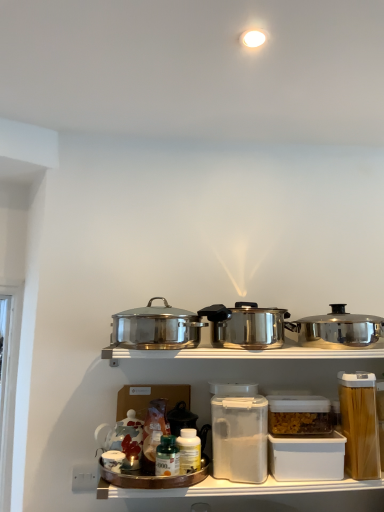
Consider the image. Measure the distance between polished stainless steel pot at right, the third kitchen appliance from the left, and camera.

polished stainless steel pot at right, the third kitchen appliance from the left, and camera are 1.32 meters apart.

This screenshot has height=512, width=384. Identify the location of white plastic bottle at center, the second bottle in the left-to-right sequence. click(x=189, y=450).

The width and height of the screenshot is (384, 512). I want to click on green glass bottle at center, positioned as the second bottle in right-to-left order, so pos(167,457).

Identify the location of polished stainless steel pot at right, the third kitchen appliance from the left. (337, 329).

From the image's perspective, which one is positioned lower, polished stainless steel pot at center, placed as the first kitchen appliance when sorted from left to right, or green glass bottle at center, the first bottle from the left?

green glass bottle at center, the first bottle from the left.

Choose the correct answer: Is polished stainless steel pot at center, placed as the first kitchen appliance when sorted from left to right, inside green glass bottle at center, positioned as the second bottle in right-to-left order, or outside it?

polished stainless steel pot at center, placed as the first kitchen appliance when sorted from left to right, lies outside green glass bottle at center, positioned as the second bottle in right-to-left order.

Is polished stainless steel pot at center, arranged as the third kitchen appliance when viewed from the right, shorter than green glass bottle at center, the first bottle from the left?

In fact, polished stainless steel pot at center, arranged as the third kitchen appliance when viewed from the right, may be taller than green glass bottle at center, the first bottle from the left.

Where is `kitchen appliance that is the 1st object above the green glass bottle at center, positioned as the second bottle in right-to-left order (from a real-world perspective)`? The height and width of the screenshot is (512, 384). kitchen appliance that is the 1st object above the green glass bottle at center, positioned as the second bottle in right-to-left order (from a real-world perspective) is located at coordinates (156, 327).

Is point (166, 467) positioned before point (299, 432)?

Yes, point (166, 467) is closer to viewer.

Relative to clear plastic container at center, which is counted as the 2th appliance, starting from the right, is green glass bottle at center, positioned as the second bottle in right-to-left order, in front or behind?

green glass bottle at center, positioned as the second bottle in right-to-left order, is positioned closer to the viewer than clear plastic container at center, which is counted as the 2th appliance, starting from the right.

From a real-world perspective, is green glass bottle at center, positioned as the second bottle in right-to-left order, under clear plastic container at center, the 2th appliance when ordered from left to right?

Yes, from a real-world perspective, green glass bottle at center, positioned as the second bottle in right-to-left order, is under clear plastic container at center, the 2th appliance when ordered from left to right.

Is green glass bottle at center, positioned as the second bottle in right-to-left order, facing towards clear plastic container at center, the 2th appliance when ordered from left to right?

No, green glass bottle at center, positioned as the second bottle in right-to-left order, is not facing towards clear plastic container at center, the 2th appliance when ordered from left to right.

Can you see clear plastic container at center, which is counted as the 2th appliance, starting from the right, touching polished stainless steel pot at center, placed as the 2th kitchen appliance when sorted from right to left?

clear plastic container at center, which is counted as the 2th appliance, starting from the right, and polished stainless steel pot at center, placed as the 2th kitchen appliance when sorted from right to left, are clearly separated.

From a real-world perspective, who is located higher, clear plastic container at center, which is counted as the 2th appliance, starting from the right, or polished stainless steel pot at center, the 2th kitchen appliance when ordered from left to right?

polished stainless steel pot at center, the 2th kitchen appliance when ordered from left to right, is physically above.

Looking at this image, measure the distance between clear plastic container at center, which is counted as the 2th appliance, starting from the right, and polished stainless steel pot at center, placed as the 2th kitchen appliance when sorted from right to left.

The distance of clear plastic container at center, which is counted as the 2th appliance, starting from the right, from polished stainless steel pot at center, placed as the 2th kitchen appliance when sorted from right to left, is 9.97 inches.

Which object is wider, clear plastic container at center, the 2th appliance when ordered from left to right, or polished stainless steel pot at center, placed as the 2th kitchen appliance when sorted from right to left?

polished stainless steel pot at center, placed as the 2th kitchen appliance when sorted from right to left.

From a real-world perspective, which object rests below the other?

translucent plastic container at center, which ranks as the 3th appliance in right-to-left order, is physically lower.

Consider the image. Between translucent plastic container at center, placed as the first appliance when sorted from left to right, and clear plastic container at lower right, placed as the 1th appliance when sorted from right to left, which one has more height?

clear plastic container at lower right, placed as the 1th appliance when sorted from right to left, is taller.

Considering the sizes of objects translucent plastic container at center, placed as the first appliance when sorted from left to right, and clear plastic container at lower right, the 3th appliance viewed from the left, in the image provided, who is wider, translucent plastic container at center, placed as the first appliance when sorted from left to right, or clear plastic container at lower right, the 3th appliance viewed from the left,?

With larger width is translucent plastic container at center, placed as the first appliance when sorted from left to right.

Which is closer to the camera, (248, 472) or (339, 399)?

The point (248, 472) is closer to the camera.

From the image's perspective, which one is positioned higher, polished stainless steel pot at right, arranged as the 1th kitchen appliance when viewed from the right, or polished stainless steel pot at center, placed as the first kitchen appliance when sorted from left to right?

polished stainless steel pot at center, placed as the first kitchen appliance when sorted from left to right, appears higher in the image.

In the image, is polished stainless steel pot at right, arranged as the 1th kitchen appliance when viewed from the right, positioned in front of or behind polished stainless steel pot at center, placed as the first kitchen appliance when sorted from left to right?

In the image, polished stainless steel pot at right, arranged as the 1th kitchen appliance when viewed from the right, appears behind polished stainless steel pot at center, placed as the first kitchen appliance when sorted from left to right.

Is polished stainless steel pot at right, arranged as the 1th kitchen appliance when viewed from the right, bigger or smaller than polished stainless steel pot at center, arranged as the third kitchen appliance when viewed from the right?

Clearly, polished stainless steel pot at right, arranged as the 1th kitchen appliance when viewed from the right, is smaller in size than polished stainless steel pot at center, arranged as the third kitchen appliance when viewed from the right.

Considering the relative positions of polished stainless steel pot at right, arranged as the 1th kitchen appliance when viewed from the right, and polished stainless steel pot at center, arranged as the third kitchen appliance when viewed from the right, in the image provided, is polished stainless steel pot at right, arranged as the 1th kitchen appliance when viewed from the right, to the left of polished stainless steel pot at center, arranged as the third kitchen appliance when viewed from the right, from the viewer's perspective?

Incorrect, polished stainless steel pot at right, arranged as the 1th kitchen appliance when viewed from the right, is not on the left side of polished stainless steel pot at center, arranged as the third kitchen appliance when viewed from the right.

Considering the sizes of polished stainless steel pot at right, the third kitchen appliance from the left, and clear plastic container at lower right, the 3th appliance viewed from the left, in the image, is polished stainless steel pot at right, the third kitchen appliance from the left, taller or shorter than clear plastic container at lower right, the 3th appliance viewed from the left,?

Considering their sizes, polished stainless steel pot at right, the third kitchen appliance from the left, has less height than clear plastic container at lower right, the 3th appliance viewed from the left.

Based on their sizes in the image, would you say polished stainless steel pot at right, the third kitchen appliance from the left, is bigger or smaller than clear plastic container at lower right, placed as the 1th appliance when sorted from right to left?

Clearly, polished stainless steel pot at right, the third kitchen appliance from the left, is larger in size than clear plastic container at lower right, placed as the 1th appliance when sorted from right to left.

Where is `appliance that is the 1st object to the left of the polished stainless steel pot at right, the third kitchen appliance from the left, starting at the anchor`? appliance that is the 1st object to the left of the polished stainless steel pot at right, the third kitchen appliance from the left, starting at the anchor is located at coordinates (360, 424).

Is polished stainless steel pot at right, the third kitchen appliance from the left, behind clear plastic container at lower right, the 3th appliance viewed from the left?

Yes, polished stainless steel pot at right, the third kitchen appliance from the left, is further from the viewer.

From a real-world perspective, does green glass bottle at center, the first bottle from the left, sit lower than clear plastic container at lower right, the 3th appliance viewed from the left?

Indeed, from a real-world perspective, green glass bottle at center, the first bottle from the left, is positioned beneath clear plastic container at lower right, the 3th appliance viewed from the left.

In terms of width, does green glass bottle at center, the first bottle from the left, look wider or thinner when compared to clear plastic container at lower right, placed as the 1th appliance when sorted from right to left?

Clearly, green glass bottle at center, the first bottle from the left, has less width compared to clear plastic container at lower right, placed as the 1th appliance when sorted from right to left.

Looking at this image, is green glass bottle at center, positioned as the second bottle in right-to-left order, positioned far away from clear plastic container at lower right, the 3th appliance viewed from the left?

That's not correct — green glass bottle at center, positioned as the second bottle in right-to-left order, is a little close to clear plastic container at lower right, the 3th appliance viewed from the left.

From the image's perspective, between green glass bottle at center, positioned as the second bottle in right-to-left order, and clear plastic container at lower right, the 3th appliance viewed from the left, who is located below?

From the image's view, green glass bottle at center, positioned as the second bottle in right-to-left order, is below.

The image size is (384, 512). I want to click on kitchen appliance located on the left of green glass bottle at center, the first bottle from the left, so click(x=156, y=327).

From a real-world perspective, count 2nd bottles downward from the clear plastic container at center, the 2th appliance when ordered from left to right, and point to it. Please provide its 2D coordinates.

[(167, 457)]

From the image, which object appears to be nearer to clear plastic container at center, the 2th appliance when ordered from left to right, polished stainless steel pot at center, arranged as the third kitchen appliance when viewed from the right, or polished stainless steel pot at center, placed as the 2th kitchen appliance when sorted from right to left?

polished stainless steel pot at center, placed as the 2th kitchen appliance when sorted from right to left.

Based on their spatial positions, is polished stainless steel pot at right, arranged as the 1th kitchen appliance when viewed from the right, or white plastic container at lower center closer to polished stainless steel pot at center, placed as the 2th kitchen appliance when sorted from right to left?

Among the two, polished stainless steel pot at right, arranged as the 1th kitchen appliance when viewed from the right, is located nearer to polished stainless steel pot at center, placed as the 2th kitchen appliance when sorted from right to left.

Considering their positions, is white plastic container at lower center positioned closer to clear plastic container at lower right, the 3th appliance viewed from the left, than translucent plastic container at center, which ranks as the 3th appliance in right-to-left order?

white plastic container at lower center.

Estimate the real-world distances between objects in this image. Which object is closer to clear plastic container at center, the 2th appliance when ordered from left to right, white plastic bottle at center, the second bottle in the left-to-right sequence, or polished stainless steel pot at center, arranged as the third kitchen appliance when viewed from the right?

Among the two, white plastic bottle at center, the second bottle in the left-to-right sequence, is located nearer to clear plastic container at center, the 2th appliance when ordered from left to right.

When comparing their distances from clear plastic container at center, which is counted as the 2th appliance, starting from the right, does polished stainless steel pot at center, placed as the 2th kitchen appliance when sorted from right to left, or clear plastic container at lower right, the 3th appliance viewed from the left, seem closer?

Based on the image, clear plastic container at lower right, the 3th appliance viewed from the left, appears to be nearer to clear plastic container at center, which is counted as the 2th appliance, starting from the right.

Based on their spatial positions, is polished stainless steel pot at center, placed as the 2th kitchen appliance when sorted from right to left, or white plastic bottle at center, the second bottle in the left-to-right sequence, closer to polished stainless steel pot at center, arranged as the third kitchen appliance when viewed from the right?

Based on the image, polished stainless steel pot at center, placed as the 2th kitchen appliance when sorted from right to left, appears to be nearer to polished stainless steel pot at center, arranged as the third kitchen appliance when viewed from the right.

When comparing their distances from translucent plastic container at center, which ranks as the 3th appliance in right-to-left order, does polished stainless steel pot at center, placed as the 2th kitchen appliance when sorted from right to left, or green glass bottle at center, positioned as the second bottle in right-to-left order, seem further?

polished stainless steel pot at center, placed as the 2th kitchen appliance when sorted from right to left, is positioned further to the anchor translucent plastic container at center, which ranks as the 3th appliance in right-to-left order.

When comparing their distances from polished stainless steel pot at right, arranged as the 1th kitchen appliance when viewed from the right, does white plastic bottle at center, the second bottle in the left-to-right sequence, or white plastic container at lower center seem closer?

Based on the image, white plastic container at lower center appears to be nearer to polished stainless steel pot at right, arranged as the 1th kitchen appliance when viewed from the right.

This screenshot has width=384, height=512. I want to click on bottle that lies between polished stainless steel pot at center, the 2th kitchen appliance when ordered from left to right, and white plastic bottle at center, the 1th bottle in the right-to-left sequence, from top to bottom, so click(x=167, y=457).

You are a GUI agent. You are given a task and a screenshot of the screen. Output one action in this format:
    pyautogui.click(x=<x>, y=<y>)
    Task: Click on the box between white plastic bottle at center, the second bottle in the left-to-right sequence, and polished stainless steel pot at right, the third kitchen appliance from the left, from left to right
    
    Given the screenshot: What is the action you would take?
    pyautogui.click(x=307, y=457)

This screenshot has width=384, height=512. In order to click on appliance between translucent plastic container at center, placed as the first appliance when sorted from left to right, and clear plastic container at lower right, placed as the 1th appliance when sorted from right to left, in the horizontal direction in this screenshot , I will do `click(299, 415)`.

Where is `appliance situated between polished stainless steel pot at center, placed as the 2th kitchen appliance when sorted from right to left, and clear plastic container at lower right, the 3th appliance viewed from the left, from left to right`? appliance situated between polished stainless steel pot at center, placed as the 2th kitchen appliance when sorted from right to left, and clear plastic container at lower right, the 3th appliance viewed from the left, from left to right is located at coordinates (299, 415).